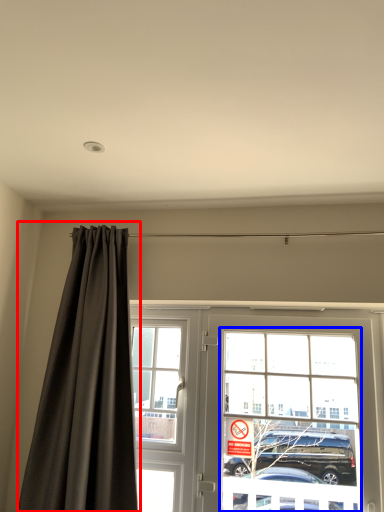
Question: Which object is closer to the camera taking this photo, curtain (highlighted by a red box) or bay window (highlighted by a blue box)?

Choices:
 (A) curtain
 (B) bay window

Answer: (A)